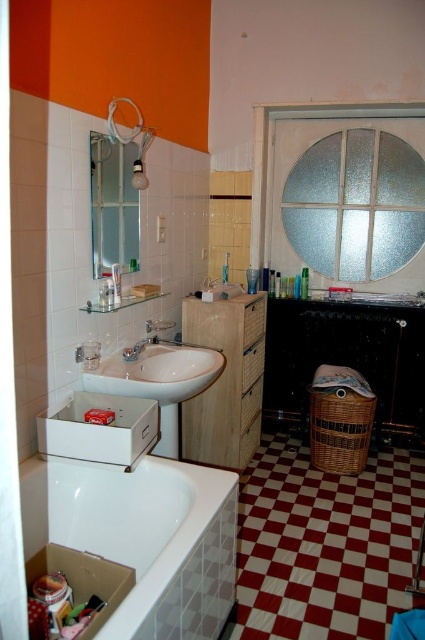
Question: Is white glossy bathtub at lower left positioned before matte white shower at upper left?

Choices:
 (A) yes
 (B) no

Answer: (A)

Question: Which point is closer to the camera?

Choices:
 (A) white glossy sink at center
 (B) wooden cabinet at center

Answer: (A)

Question: Which object is the closest to the white glossy bathtub at lower left?

Choices:
 (A) white glossy sink at center
 (B) matte white shower at upper left

Answer: (A)

Question: Can you confirm if matte white shower at upper left is positioned to the right of brushed metal faucet at sink left?

Choices:
 (A) no
 (B) yes

Answer: (B)

Question: Which object is positioned farthest from the clear glass mirror at upper left?

Choices:
 (A) white glossy sink at center
 (B) wooden cabinet at center
 (C) matte white shower at upper left

Answer: (B)

Question: Is wooden cabinet at center above brushed metal faucet at sink left?

Choices:
 (A) yes
 (B) no

Answer: (B)